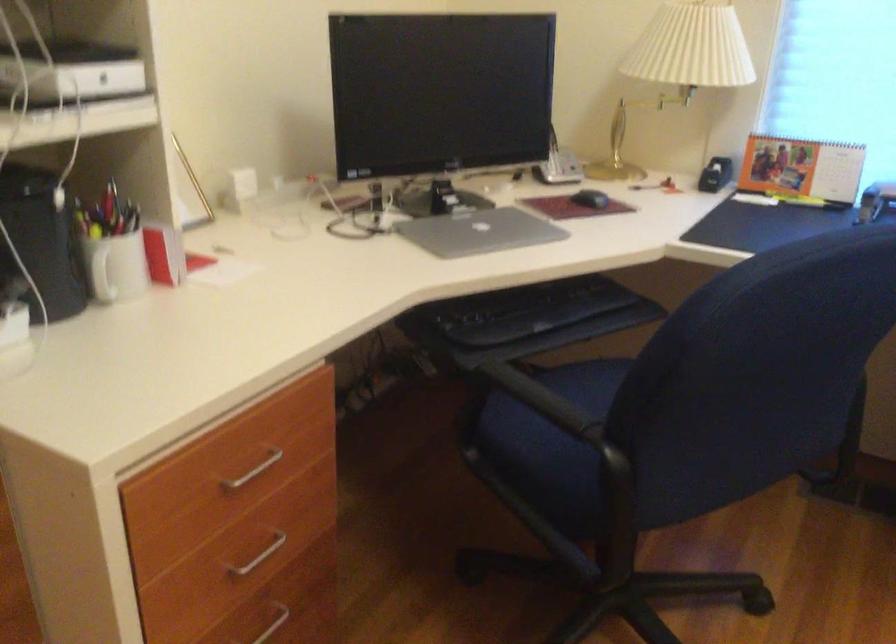
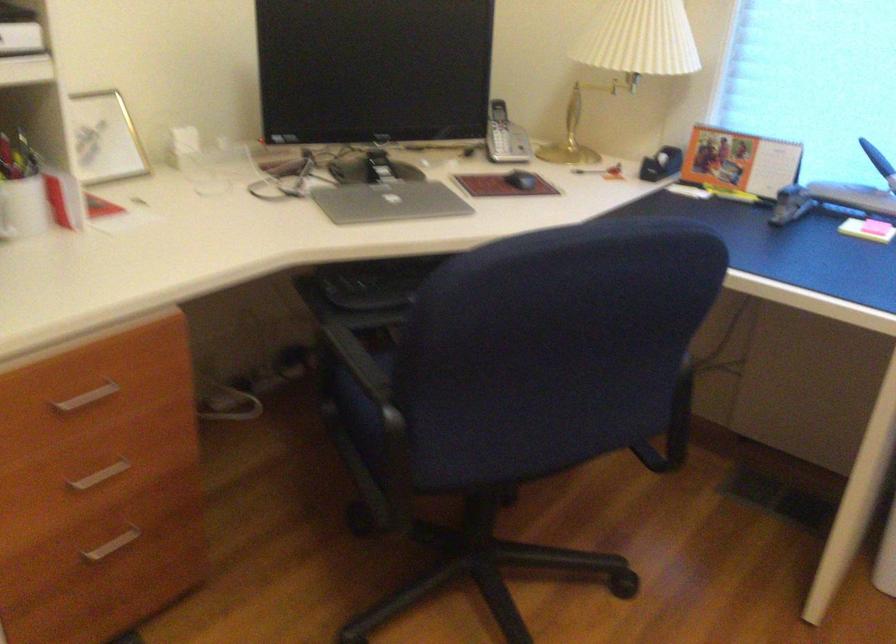
Locate, in the second image, the point that corresponds to (x=554, y=415) in the first image.

(365, 375)